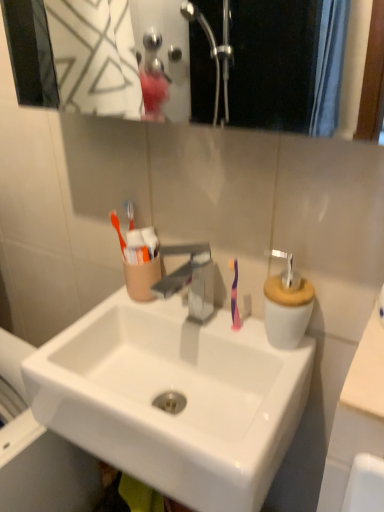
Describe the element at coordinates (190, 279) in the screenshot. This screenshot has height=512, width=384. I see `metallic silver faucet at center` at that location.

What are the coordinates of `white glossy counter top at lower right, arranged as the 1th counter top when viewed from the left` in the screenshot? It's located at (356, 415).

The width and height of the screenshot is (384, 512). Describe the element at coordinates (356, 415) in the screenshot. I see `white glossy counter top at lower right, arranged as the second counter top when viewed from the right` at that location.

Where is `white glossy sink at center`? The image size is (384, 512). white glossy sink at center is located at coordinates (173, 400).

Is the depth of white glossy sink at center less than that of metallic silver faucet at center?

Yes.

You are a GUI agent. You are given a task and a screenshot of the screen. Output one action in this format:
    pyautogui.click(x=<x>, y=<y>)
    Task: Click on the tap behind the white glossy sink at center
    
    Given the screenshot: What is the action you would take?
    pyautogui.click(x=190, y=279)

Between white glossy sink at center and metallic silver faucet at center, which one has more height?

white glossy sink at center.

How many degrees apart are the facing directions of white glossy sink at center and metallic silver faucet at center?

They differ by 0.000351 degrees in their facing directions.

Would you say purple glossy toothbrush at center is outside metallic silver faucet at center?

purple glossy toothbrush at center is positioned outside metallic silver faucet at center.

From a real-world perspective, between purple glossy toothbrush at center and metallic silver faucet at center, who is vertically lower?

From a 3D spatial view, metallic silver faucet at center is below.

Considering the relative sizes of purple glossy toothbrush at center and metallic silver faucet at center in the image provided, is purple glossy toothbrush at center taller than metallic silver faucet at center?

Indeed, purple glossy toothbrush at center has a greater height compared to metallic silver faucet at center.

Where is `tap in front of the purple glossy toothbrush at center`? The height and width of the screenshot is (512, 384). tap in front of the purple glossy toothbrush at center is located at coordinates (190, 279).

From the image's perspective, between white glossy counter top at lower right, arranged as the second counter top when viewed from the right, and purple glossy toothbrush at center, who is located below?

white glossy counter top at lower right, arranged as the second counter top when viewed from the right, from the image's perspective.

In the image, is white glossy counter top at lower right, arranged as the 1th counter top when viewed from the left, on the left side or the right side of purple glossy toothbrush at center?

white glossy counter top at lower right, arranged as the 1th counter top when viewed from the left, is positioned on purple glossy toothbrush at center's right side.

Is point (367, 400) positioned after point (235, 270)?

No, (367, 400) is closer to viewer.

From the image's perspective, which object appears higher, white glossy counter top at lower right, arranged as the second counter top when viewed from the right, or metallic silver faucet at center?

metallic silver faucet at center, from the image's perspective.

Is white glossy counter top at lower right, arranged as the 1th counter top when viewed from the left, not inside metallic silver faucet at center?

Yes, white glossy counter top at lower right, arranged as the 1th counter top when viewed from the left, is outside of metallic silver faucet at center.

Based on their positions, is white glossy counter top at lower right, arranged as the second counter top when viewed from the right, located to the left or right of metallic silver faucet at center?

Based on their positions, white glossy counter top at lower right, arranged as the second counter top when viewed from the right, is located to the right of metallic silver faucet at center.

Can you confirm if white glossy counter top at lower right, arranged as the 1th counter top when viewed from the left, is wider than metallic silver faucet at center?

No, white glossy counter top at lower right, arranged as the 1th counter top when viewed from the left, is not wider than metallic silver faucet at center.

Between white ceramic soap dispenser at right and white glossy counter top at lower right, arranged as the second counter top when viewed from the right, which one appears on the right side from the viewer's perspective?

Positioned to the right is white glossy counter top at lower right, arranged as the second counter top when viewed from the right.

Between white ceramic soap dispenser at right and white glossy counter top at lower right, arranged as the 1th counter top when viewed from the left, which one has smaller size?

white ceramic soap dispenser at right.

How different are the orientations of white ceramic soap dispenser at right and white glossy counter top at lower right, arranged as the second counter top when viewed from the right, in degrees?

91.4 degrees separate the facing orientations of white ceramic soap dispenser at right and white glossy counter top at lower right, arranged as the second counter top when viewed from the right.

Which of these two, white ceramic soap dispenser at right or white glossy counter top at lower right, arranged as the second counter top when viewed from the right, stands taller?

With more height is white glossy counter top at lower right, arranged as the second counter top when viewed from the right.

How different are the orientations of white ceramic soap dispenser at right and purple glossy toothbrush at center in degrees?

There is a 0.00637-degree angle between the facing directions of white ceramic soap dispenser at right and purple glossy toothbrush at center.

Is white ceramic soap dispenser at right wider than purple glossy toothbrush at center?

Indeed, white ceramic soap dispenser at right has a greater width compared to purple glossy toothbrush at center.

From a real-world perspective, does white ceramic soap dispenser at right sit lower than purple glossy toothbrush at center?

No, from a real-world perspective, white ceramic soap dispenser at right is not below purple glossy toothbrush at center.

From the image's perspective, which object appears higher, white ceramic soap dispenser at right or purple glossy toothbrush at center?

purple glossy toothbrush at center.

Is white ceramic soap dispenser at right next to beige matte counter top at right, arranged as the 1th counter top when viewed from the right, and touching it?

No, white ceramic soap dispenser at right is not in contact with beige matte counter top at right, arranged as the 1th counter top when viewed from the right.

Does point (280, 251) appear closer or farther from the camera than point (375, 309)?

Point (280, 251) appears to be farther away from the viewer than point (375, 309).

Is the depth of white ceramic soap dispenser at right greater than that of beige matte counter top at right, arranged as the second counter top when viewed from the left?

Yes, the depth of white ceramic soap dispenser at right is greater than that of beige matte counter top at right, arranged as the second counter top when viewed from the left.

Does white ceramic soap dispenser at right appear on the right side of beige matte counter top at right, arranged as the second counter top when viewed from the left?

No, white ceramic soap dispenser at right is not to the right of beige matte counter top at right, arranged as the second counter top when viewed from the left.

Image resolution: width=384 pixels, height=512 pixels. What are the coordinates of `tap on the right side of white glossy sink at center` in the screenshot? It's located at click(190, 279).

The width and height of the screenshot is (384, 512). Find the location of `toothbrush above the metallic silver faucet at center (from a real-world perspective)`. toothbrush above the metallic silver faucet at center (from a real-world perspective) is located at coordinates (234, 296).

Considering their positions, is white glossy counter top at lower right, arranged as the second counter top when viewed from the right, positioned further to white glossy sink at center than metallic silver faucet at center?

Based on the image, white glossy counter top at lower right, arranged as the second counter top when viewed from the right, appears to be further to white glossy sink at center.

Based on their spatial positions, is white glossy counter top at lower right, arranged as the second counter top when viewed from the right, or beige matte counter top at right, arranged as the second counter top when viewed from the left, further from purple glossy toothbrush at center?

The object further to purple glossy toothbrush at center is white glossy counter top at lower right, arranged as the second counter top when viewed from the right.

From the picture: Looking at the image, which one is located closer to white glossy counter top at lower right, arranged as the second counter top when viewed from the right, white ceramic soap dispenser at right or metallic silver faucet at center?

white ceramic soap dispenser at right is closer to white glossy counter top at lower right, arranged as the second counter top when viewed from the right.

Based on their spatial positions, is metallic silver faucet at center or purple glossy toothbrush at center further from white glossy counter top at lower right, arranged as the 1th counter top when viewed from the left?

metallic silver faucet at center.

Which object lies further to the anchor point white ceramic soap dispenser at right, metallic silver faucet at center or white glossy sink at center?

white glossy sink at center is positioned further to the anchor white ceramic soap dispenser at right.

Estimate the real-world distances between objects in this image. Which object is closer to beige matte counter top at right, arranged as the 1th counter top when viewed from the right, metallic silver faucet at center or purple glossy toothbrush at center?

Based on the image, purple glossy toothbrush at center appears to be nearer to beige matte counter top at right, arranged as the 1th counter top when viewed from the right.

Based on their spatial positions, is white glossy sink at center or white glossy counter top at lower right, arranged as the second counter top when viewed from the right, further from beige matte counter top at right, arranged as the second counter top when viewed from the left?

white glossy sink at center is further to beige matte counter top at right, arranged as the second counter top when viewed from the left.

Looking at the image, which one is located closer to white glossy sink at center, purple glossy toothbrush at center or white glossy counter top at lower right, arranged as the second counter top when viewed from the right?

The object closer to white glossy sink at center is purple glossy toothbrush at center.

The height and width of the screenshot is (512, 384). In order to click on soap dispenser located between white glossy sink at center and beige matte counter top at right, arranged as the 1th counter top when viewed from the right, in the left-right direction in this screenshot , I will do `click(287, 305)`.

Find the location of a particular element. The image size is (384, 512). counter top situated between white glossy sink at center and beige matte counter top at right, arranged as the 1th counter top when viewed from the right, from left to right is located at coordinates pos(356,415).

This screenshot has height=512, width=384. In order to click on soap dispenser between metallic silver faucet at center and beige matte counter top at right, arranged as the 1th counter top when viewed from the right, in the horizontal direction in this screenshot , I will do `click(287, 305)`.

The width and height of the screenshot is (384, 512). What are the coordinates of `toothbrush situated between metallic silver faucet at center and white ceramic soap dispenser at right from left to right` in the screenshot? It's located at (234, 296).